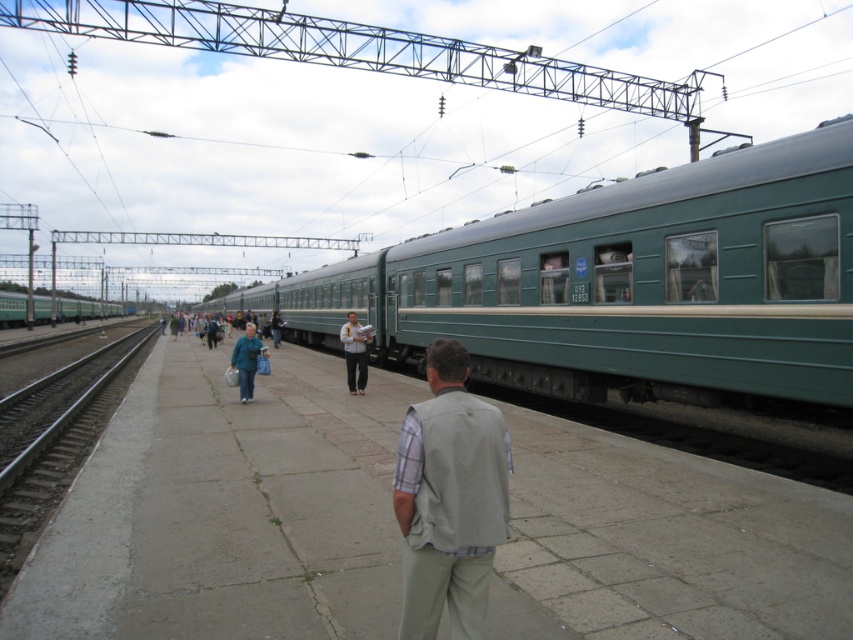
You are standing on the platform and want to board the train. The green matte train at left and the teal fabric jacket at center are in your line of sight. Which object is closer to the left side of your view?

The green matte train at left is closer to the left side of your view because it is positioned to the left of the teal fabric jacket at center.

You are a passenger waiting at the railway station platform. You see the green matte train at center and the beige fabric vest at center. Which object is taller?

The green matte train at center is taller than the beige fabric vest at center.

You are a passenger waiting at the railway station platform. You see the green matte train at left and the teal fabric jacket at center. Which object is positioned higher from the ground?

The green matte train at left is located above the teal fabric jacket at center, so it is positioned higher from the ground.